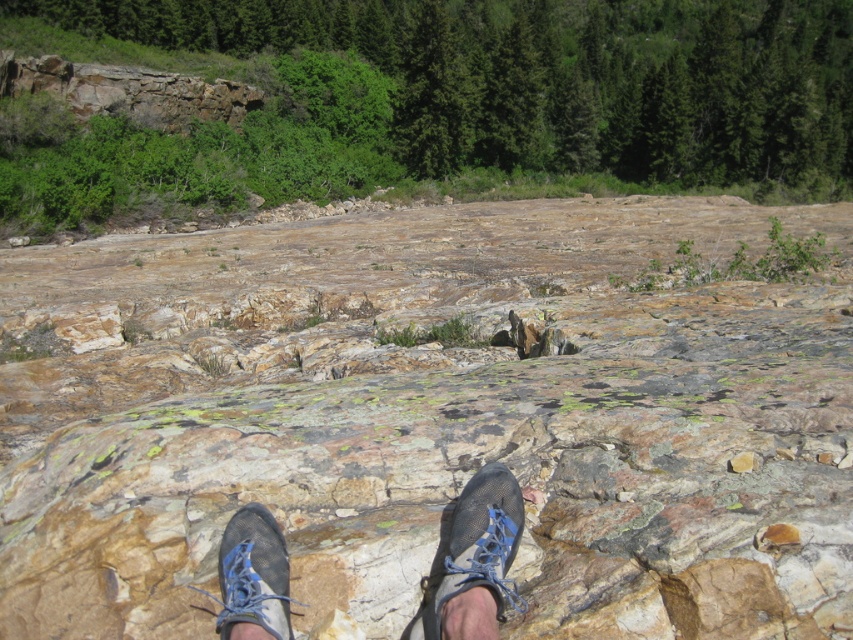
Question: Does textured gray shoes at center lie behind matte gray shoe at center?

Choices:
 (A) yes
 (B) no

Answer: (B)

Question: Which object is farther from the camera taking this photo?

Choices:
 (A) matte black shoe at center
 (B) matte gray shoe at center
 (C) textured gray shoes at center

Answer: (B)

Question: Is textured gray shoes at center below matte gray shoe at center?

Choices:
 (A) yes
 (B) no

Answer: (A)

Question: Does matte gray shoe at center have a lesser width compared to matte black shoe at center?

Choices:
 (A) yes
 (B) no

Answer: (B)

Question: Which object is closer to the camera taking this photo?

Choices:
 (A) matte black shoe at center
 (B) matte gray shoe at center
 (C) textured gray shoes at center

Answer: (C)

Question: Which is farther from the textured gray shoes at center?

Choices:
 (A) matte black shoe at center
 (B) matte gray shoe at center

Answer: (A)